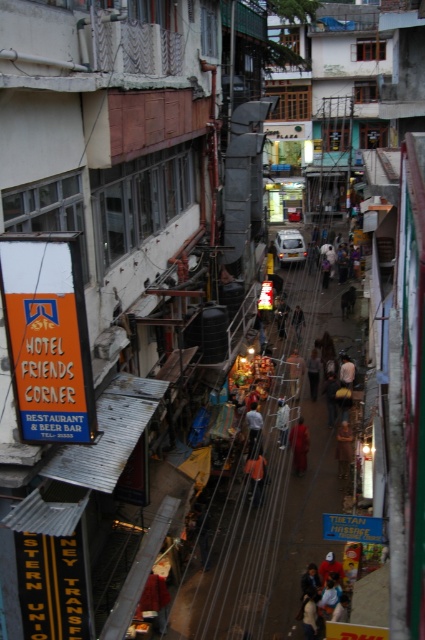
Which is in front, point (297, 467) or point (251, 461)?

Point (251, 461)

Is dark red fabric at center thinner than orange fabric person at center?

Incorrect, dark red fabric at center's width is not less than orange fabric person at center's.

Is point (300, 424) positioned in front of point (263, 460)?

No, it is not.

At what (x,y) coordinates should I click in order to perform the action: click on dark red fabric at center. Please return your answer as a coordinate pair (x, y). Looking at the image, I should click on (300, 445).

Can you confirm if orange fabric person at center is bigger than orange fabric bag at center?

No, orange fabric person at center is not bigger than orange fabric bag at center.

Locate an element on the screen. The image size is (425, 640). orange fabric person at center is located at coordinates (255, 476).

Is dark brown leather jacket at center to the right of orange fabric person at center from the viewer's perspective?

Correct, you'll find dark brown leather jacket at center to the right of orange fabric person at center.

Between dark brown leather jacket at center and orange fabric person at center, which one appears on the right side from the viewer's perspective?

From the viewer's perspective, dark brown leather jacket at center appears more on the right side.

Which is behind, point (348, 435) or point (257, 493)?

Point (348, 435)

Locate an element on the screen. Image resolution: width=425 pixels, height=640 pixels. dark brown leather jacket at center is located at coordinates (343, 449).